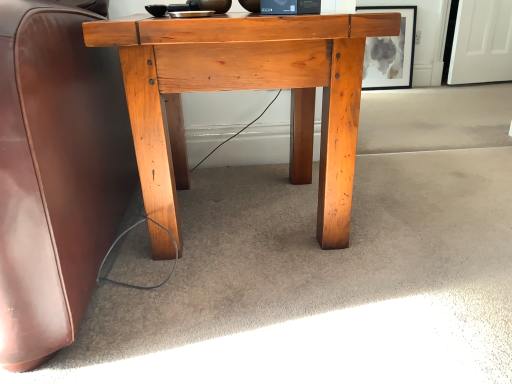
Question: Relative to natural wood desk at center, is matte black picture frame at upper center in front or behind?

Choices:
 (A) front
 (B) behind

Answer: (B)

Question: Does point (404, 19) appear closer or farther from the camera than point (330, 183)?

Choices:
 (A) farther
 (B) closer

Answer: (A)

Question: Is matte black picture frame at upper center to the left or to the right of natural wood desk at center in the image?

Choices:
 (A) left
 (B) right

Answer: (B)

Question: From the image's perspective, relative to matte black picture frame at upper center, is natural wood desk at center above or below?

Choices:
 (A) below
 (B) above

Answer: (A)

Question: Based on their positions, is natural wood desk at center located to the left or right of matte black picture frame at upper center?

Choices:
 (A) right
 (B) left

Answer: (B)

Question: Is natural wood desk at center in front of or behind matte black picture frame at upper center in the image?

Choices:
 (A) behind
 (B) front

Answer: (B)

Question: Considering the positions of natural wood desk at center and matte black picture frame at upper center in the image, is natural wood desk at center taller or shorter than matte black picture frame at upper center?

Choices:
 (A) tall
 (B) short

Answer: (A)